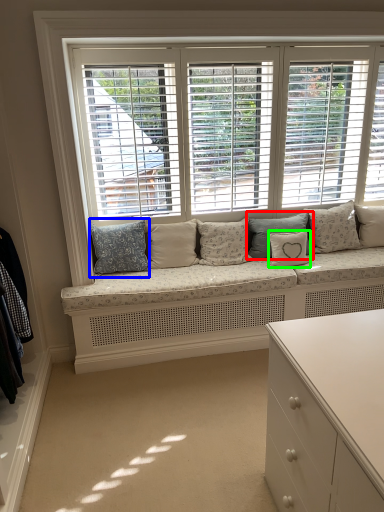
Question: Which is farther away from pillow (highlighted by a red box)? pillow (highlighted by a blue box) or pillow (highlighted by a green box)?

Choices:
 (A) pillow
 (B) pillow

Answer: (A)